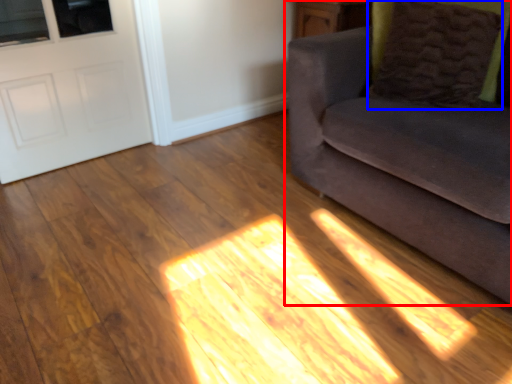
Question: Which object is closer to the camera taking this photo, studio couch (highlighted by a red box) or pillow (highlighted by a blue box)?

Choices:
 (A) studio couch
 (B) pillow

Answer: (A)